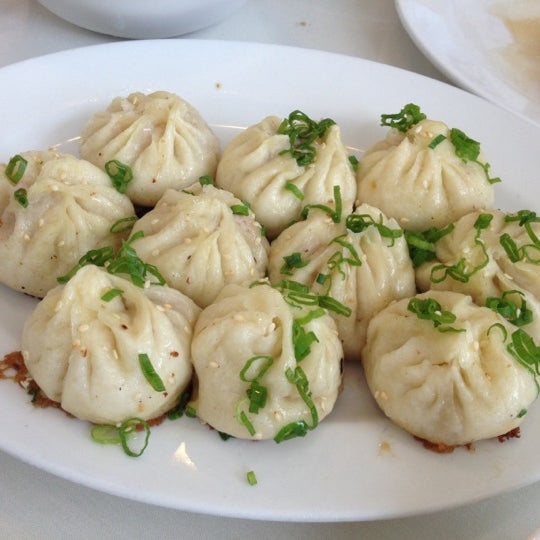
Image resolution: width=540 pixels, height=540 pixels. In order to click on white counter in this screenshot , I will do (354, 30).